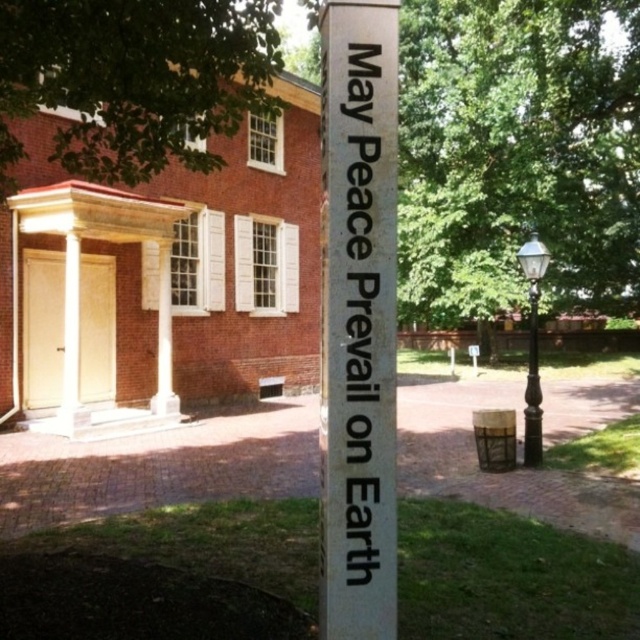
Based on the photo, which is above, white paper sign at center or black polished metal lamp post at right?

black polished metal lamp post at right is above.

Describe the element at coordinates (362, 250) in the screenshot. I see `white paper sign at center` at that location.

Which is in front, point (365, 394) or point (525, 436)?

Point (365, 394) is in front.

You are a GUI agent. You are given a task and a screenshot of the screen. Output one action in this format:
    pyautogui.click(x=<x>, y=<y>)
    Task: Click on the white paper sign at center
    The height and width of the screenshot is (640, 640).
    Given the screenshot: What is the action you would take?
    pyautogui.click(x=362, y=250)

Based on the photo, between white paper sign at center and white plastic sign at center, which one has less height?

white plastic sign at center is shorter.

Looking at this image, is white paper sign at center below white plastic sign at center?

No, white paper sign at center is not below white plastic sign at center.

What do you see at coordinates (362, 250) in the screenshot? I see `white paper sign at center` at bounding box center [362, 250].

The width and height of the screenshot is (640, 640). Find the location of `white paper sign at center`. white paper sign at center is located at coordinates (362, 250).

Which is behind, point (323, 438) or point (477, 355)?

Positioned behind is point (477, 355).

Who is more forward, (344, 538) or (476, 372)?

Point (344, 538)

Is point (337, 445) positioned in front of point (474, 348)?

Yes, point (337, 445) is in front of point (474, 348).

I want to click on white glossy sign at center, so click(358, 320).